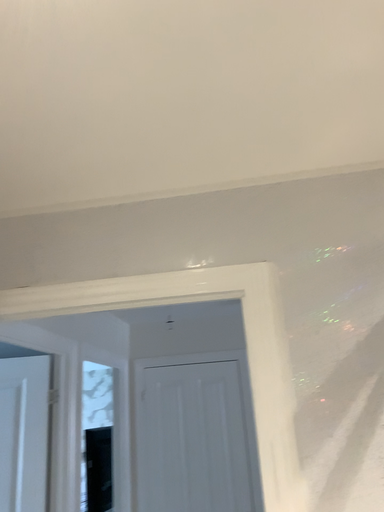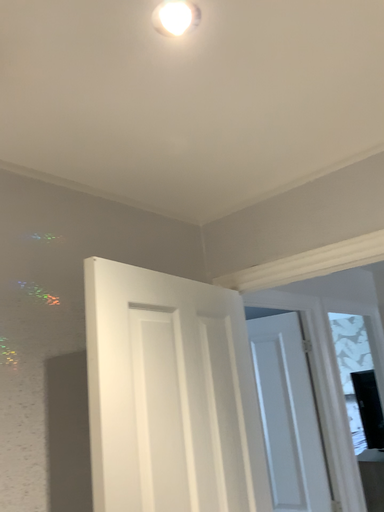
Question: Which way did the camera rotate in the video?

Choices:
 (A) rotated upward
 (B) rotated downward

Answer: (B)